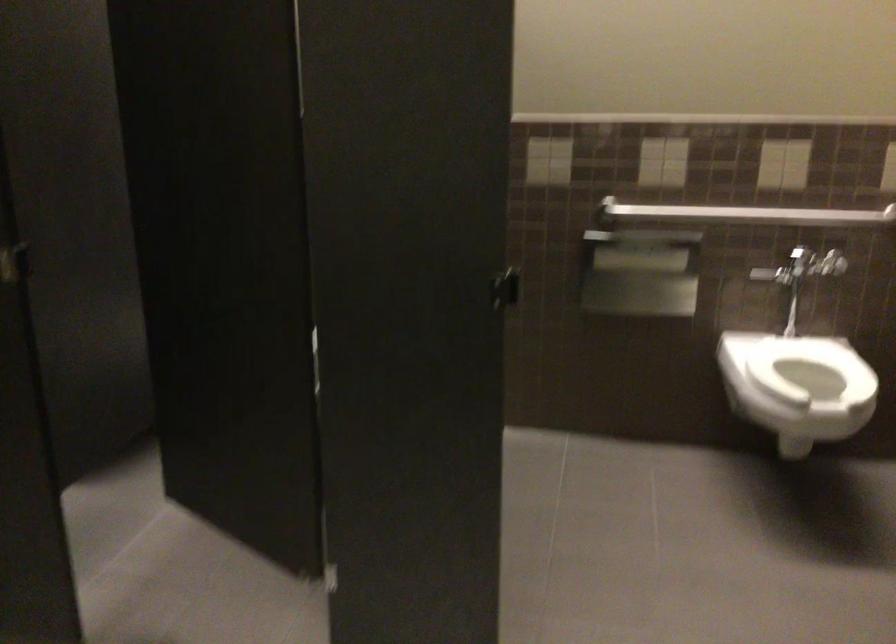
Find where to lift the white toilet seat. Please return your answer as a coordinate pair (x, y).

(810, 368)